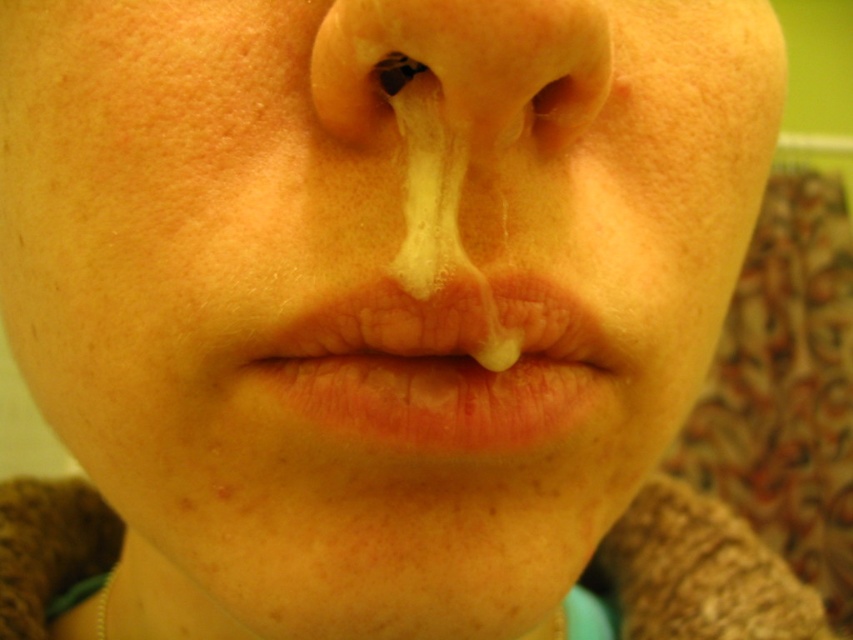
Question: Can you confirm if dry matte lips at center is positioned below smooth flesh-colored nose at center?

Choices:
 (A) no
 (B) yes

Answer: (B)

Question: Can you confirm if dry matte lips at center is positioned below smooth flesh-colored nose at center?

Choices:
 (A) no
 (B) yes

Answer: (B)

Question: Is dry matte lips at center above smooth flesh-colored nose at center?

Choices:
 (A) no
 (B) yes

Answer: (A)

Question: Which object is farther from the camera taking this photo?

Choices:
 (A) smooth flesh-colored nose at center
 (B) dry matte lips at center

Answer: (B)

Question: Which object is closer to the camera taking this photo?

Choices:
 (A) smooth flesh-colored nose at center
 (B) dry matte lips at center

Answer: (A)

Question: Which point appears farthest from the camera in this image?

Choices:
 (A) (375, 16)
 (B) (335, 332)

Answer: (B)